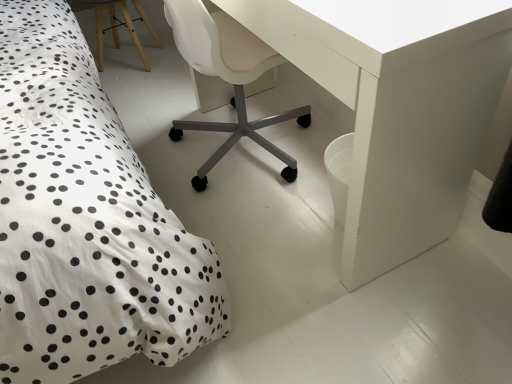
This screenshot has height=384, width=512. I want to click on white plastic chair at center, so click(227, 77).

What do you see at coordinates (227, 77) in the screenshot? I see `white plastic chair at center` at bounding box center [227, 77].

Image resolution: width=512 pixels, height=384 pixels. Find the location of `white glossy table at center`. white glossy table at center is located at coordinates (397, 107).

What do you see at coordinates (397, 107) in the screenshot? I see `white glossy table at center` at bounding box center [397, 107].

Locate an element on the screen. Image resolution: width=512 pixels, height=384 pixels. white plastic chair at center is located at coordinates (227, 77).

Based on their positions, is white glossy table at center located to the left or right of white plastic chair at center?

white glossy table at center is to the right of white plastic chair at center.

Is white glossy table at center in front of or behind white plastic chair at center in the image?

Clearly, white glossy table at center is in front of white plastic chair at center.

Is point (234, 8) positioned behind point (201, 60)?

No, (234, 8) is closer to viewer.

From the image's perspective, is white glossy table at center over white plastic chair at center?

Incorrect, from the image's perspective, white glossy table at center is lower than white plastic chair at center.

From a real-world perspective, is white glossy table at center positioned above or below white plastic chair at center?

white glossy table at center is situated higher than white plastic chair at center in the real world.

Based on the photo, considering the relative sizes of white glossy table at center and white plastic chair at center in the image provided, is white glossy table at center wider than white plastic chair at center?

No.

Considering the sizes of objects white glossy table at center and white plastic chair at center in the image provided, who is taller, white glossy table at center or white plastic chair at center?

white glossy table at center.

Can you confirm if white glossy table at center is bigger than white plastic chair at center?

Indeed, white glossy table at center has a larger size compared to white plastic chair at center.

Consider the image. Is white glossy table at center inside or outside of white plastic chair at center?

white glossy table at center lies within the bounds of white plastic chair at center.

Is white glossy table at center next to white plastic chair at center?

No, white glossy table at center is not next to white plastic chair at center.

Is white plastic chair at center at the back of white glossy table at center?

Yes.

What's the angular difference between white glossy table at center and white plastic chair at center's facing directions?

The angular difference between white glossy table at center and white plastic chair at center is 179 degrees.

The height and width of the screenshot is (384, 512). In order to click on table above the white plastic chair at center (from a real-world perspective) in this screenshot , I will do `click(397, 107)`.

Which is more to the right, white plastic chair at center or white glossy table at center?

From the viewer's perspective, white glossy table at center appears more on the right side.

Relative to white glossy table at center, is white plastic chair at center in front or behind?

Visually, white plastic chair at center is located behind white glossy table at center.

Which is in front, point (243, 113) or point (462, 172)?

Point (462, 172)

From the image's perspective, is white plastic chair at center located beneath white glossy table at center?

Incorrect, from the image's perspective, white plastic chair at center is higher than white glossy table at center.

From a real-world perspective, which object rests below the other?

In real-world perspective, white plastic chair at center is lower.

Which object is wider, white plastic chair at center or white glossy table at center?

With larger width is white plastic chair at center.

Considering the sizes of white plastic chair at center and white glossy table at center in the image, is white plastic chair at center taller or shorter than white glossy table at center?

Considering their sizes, white plastic chair at center has less height than white glossy table at center.

In the scene shown: Between white plastic chair at center and white glossy table at center, which one has smaller size?

With smaller size is white plastic chair at center.

Do you think white plastic chair at center is within white glossy table at center, or outside of it?

white plastic chair at center is contained in white glossy table at center.

Are white plastic chair at center and white glossy table at center making contact?

white plastic chair at center and white glossy table at center are not in contact.

From the picture: Is white plastic chair at center facing away from white glossy table at center?

Yes.

This screenshot has height=384, width=512. Identify the location of chair located underneath the white glossy table at center (from a real-world perspective). (227, 77).

At what (x,y) coordinates should I click in order to perform the action: click on chair above the white glossy table at center (from the image's perspective). Please return your answer as a coordinate pair (x, y). Looking at the image, I should click on (227, 77).

The width and height of the screenshot is (512, 384). There is a white plastic chair at center. In order to click on table above it (from a real-world perspective) in this screenshot , I will do [397, 107].